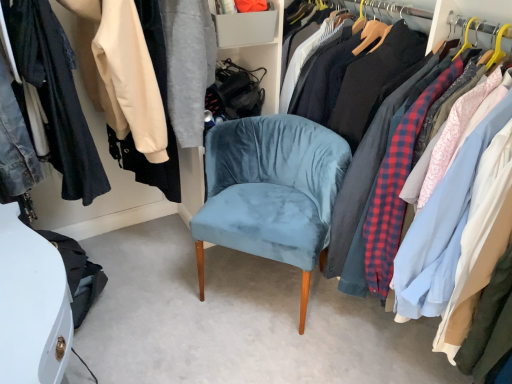
Locate an element on the screen. The image size is (512, 384). velvet blue chair at center is located at coordinates (365, 170).

This screenshot has width=512, height=384. Describe the element at coordinates (365, 170) in the screenshot. I see `velvet blue chair at center` at that location.

At what (x,y) coordinates should I click in order to perform the action: click on velvet blue chair at center. Please return your answer as a coordinate pair (x, y). Looking at the image, I should click on (271, 191).

What do you see at coordinates (271, 191) in the screenshot? The height and width of the screenshot is (384, 512). I see `velvet blue chair at center` at bounding box center [271, 191].

What are the coordinates of `velvet blue chair at center` in the screenshot? It's located at (365, 170).

Which object is positioned more to the left, velvet blue chair at center or velvet blue chair at center?

velvet blue chair at center is more to the left.

Which object is closer to the camera, velvet blue chair at center or velvet blue chair at center?

velvet blue chair at center is in front.

Is point (351, 217) behind point (205, 203)?

That is False.

From the image's perspective, would you say velvet blue chair at center is shown under velvet blue chair at center?

Correct, velvet blue chair at center appears lower than velvet blue chair at center in the image.

From a real-world perspective, does velvet blue chair at center sit lower than velvet blue chair at center?

No, from a real-world perspective, velvet blue chair at center is not beneath velvet blue chair at center.

Is velvet blue chair at center thinner than velvet blue chair at center?

Incorrect, the width of velvet blue chair at center is not less than that of velvet blue chair at center.

Can you confirm if velvet blue chair at center is taller than velvet blue chair at center?

Indeed, velvet blue chair at center has a greater height compared to velvet blue chair at center.

Does velvet blue chair at center have a smaller size compared to velvet blue chair at center?

No, velvet blue chair at center is not smaller than velvet blue chair at center.

Is velvet blue chair at center completely or partially inside velvet blue chair at center?

Actually, velvet blue chair at center is outside velvet blue chair at center.

From the picture: Is velvet blue chair at center not close to velvet blue chair at center?

velvet blue chair at center is actually quite close to velvet blue chair at center.

Is velvet blue chair at center oriented away from velvet blue chair at center?

That's not correct — velvet blue chair at center is not looking away from velvet blue chair at center.

How much distance is there between velvet blue chair at center and velvet blue chair at center?

They are 10.96 inches apart.

Image resolution: width=512 pixels, height=384 pixels. I want to click on chair on the left of velvet blue chair at center, so click(x=271, y=191).

Is velvet blue chair at center to the left or to the right of velvet blue chair at center in the image?

In the image, velvet blue chair at center appears on the left side of velvet blue chair at center.

Considering the relative positions of velvet blue chair at center and velvet blue chair at center in the image provided, is velvet blue chair at center in front of velvet blue chair at center?

No, it is not.

Is point (301, 125) closer to camera compared to point (354, 258)?

That is False.

From the image's perspective, would you say velvet blue chair at center is shown under velvet blue chair at center?

Actually, velvet blue chair at center appears above velvet blue chair at center in the image.

From a real-world perspective, is velvet blue chair at center physically located above or below velvet blue chair at center?

From a real-world perspective, velvet blue chair at center is physically below velvet blue chair at center.

Which object is wider, velvet blue chair at center or velvet blue chair at center?

With larger width is velvet blue chair at center.

Is velvet blue chair at center taller or shorter than velvet blue chair at center?

Clearly, velvet blue chair at center is shorter compared to velvet blue chair at center.

Considering the relative sizes of velvet blue chair at center and velvet blue chair at center in the image provided, is velvet blue chair at center bigger than velvet blue chair at center?

No.

Is velvet blue chair at center completely or partially inside velvet blue chair at center?

No.

Is velvet blue chair at center far away from velvet blue chair at center?

No, there isn't a large distance between velvet blue chair at center and velvet blue chair at center.

Is velvet blue chair at center oriented away from velvet blue chair at center?

No, velvet blue chair at center is not at the back of velvet blue chair at center.

What's the angular difference between velvet blue chair at center and velvet blue chair at center's facing directions?

The angle between the facing direction of velvet blue chair at center and the facing direction of velvet blue chair at center is 43.8 degrees.

You are a GUI agent. You are given a task and a screenshot of the screen. Output one action in this format:
    pyautogui.click(x=<x>, y=<y>)
    Task: Click on the closet on the right of the velvet blue chair at center
    
    Given the screenshot: What is the action you would take?
    pyautogui.click(x=365, y=170)

The image size is (512, 384). In order to click on chair above the velvet blue chair at center (from the image's perspective) in this screenshot , I will do `click(271, 191)`.

Find the location of a particular element. The width and height of the screenshot is (512, 384). closet below the velvet blue chair at center (from the image's perspective) is located at coordinates [365, 170].